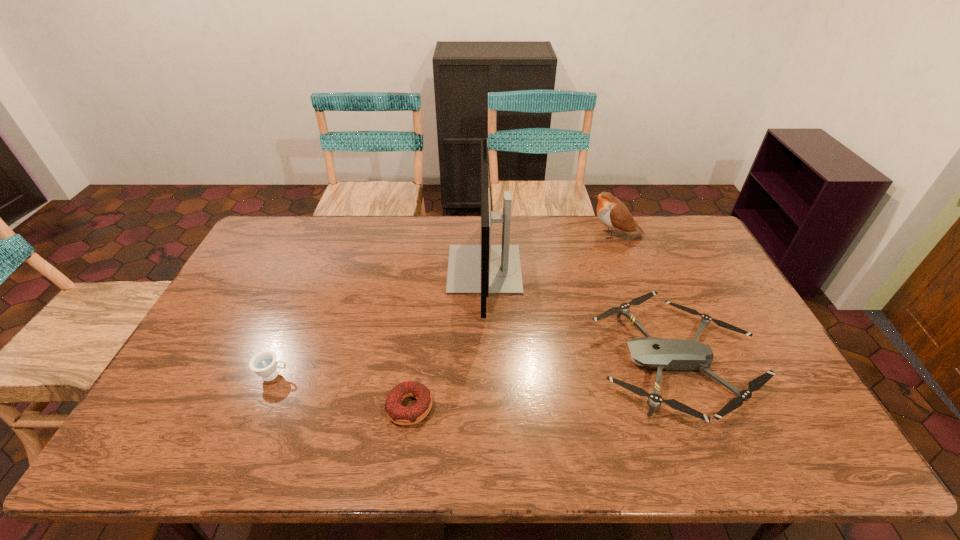
In order to click on vacant region located at the face of the bird in this screenshot , I will do `click(481, 234)`.

Find the location of `free space located 0.280m at the face of the bird`. free space located 0.280m at the face of the bird is located at coordinates (511, 234).

Where is `vacant space located 0.150m at the face of the bird`? This screenshot has width=960, height=540. vacant space located 0.150m at the face of the bird is located at coordinates (546, 234).

Locate an element on the screen. The width and height of the screenshot is (960, 540). free region located with a camera mounted on the front of the drone is located at coordinates (495, 362).

At what (x,y) coordinates should I click in order to perform the action: click on vacant area located 0.260m with a camera mounted on the front of the drone. Please return your answer as a coordinate pair (x, y). This screenshot has height=540, width=960. Looking at the image, I should click on pos(499,362).

This screenshot has height=540, width=960. I want to click on free spot located with a camera mounted on the front of the drone, so click(495, 362).

The height and width of the screenshot is (540, 960). I want to click on free space located 0.110m on the side of the leftmost object with the handle, so click(332, 375).

Locate an element on the screen. vacant region located on the right of the doughnut is located at coordinates (509, 407).

The image size is (960, 540). What are the coordinates of `computer monitor present at the far edge` in the screenshot? It's located at (484, 269).

Find the location of a particular element. Image resolution: width=960 pixels, height=540 pixels. bird present at the far edge is located at coordinates (x=614, y=214).